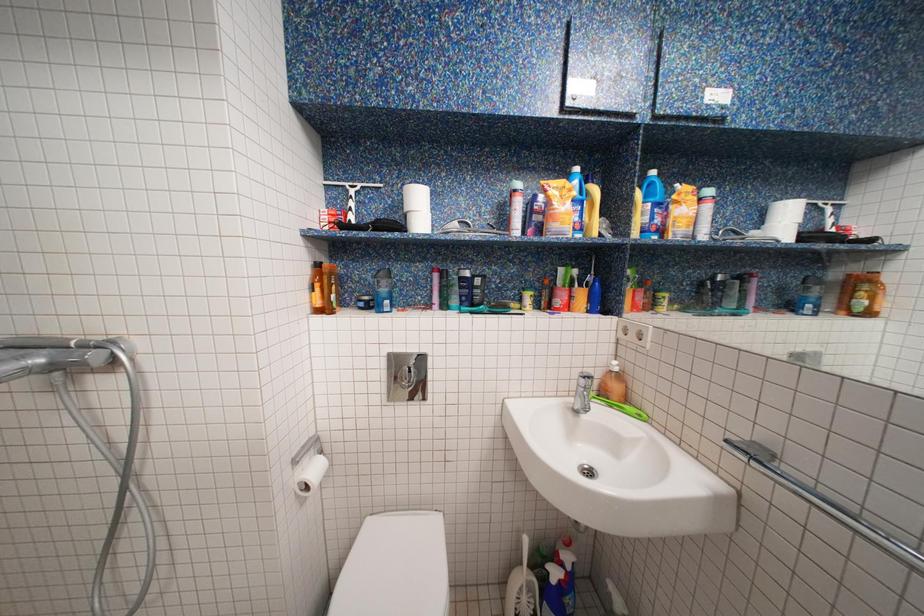
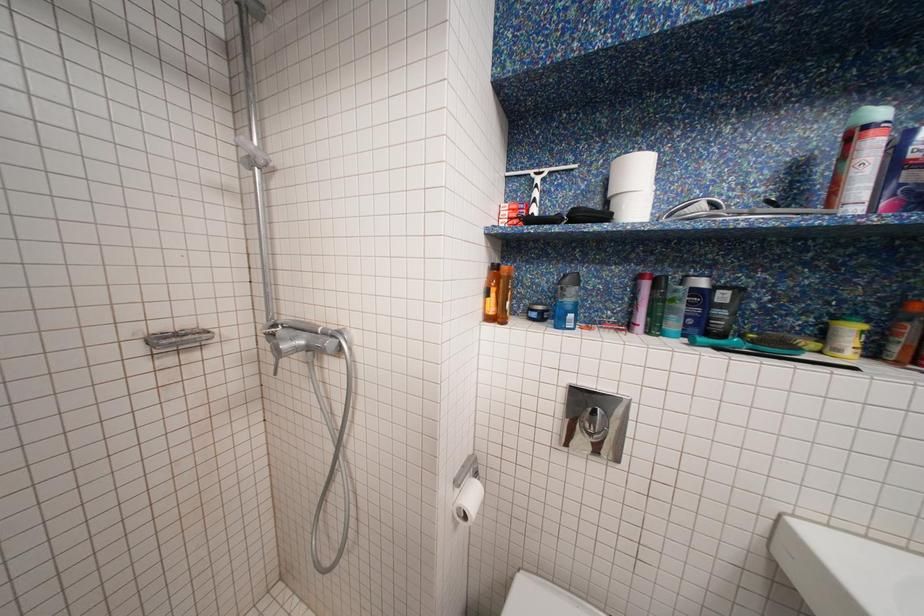
What movement of the cameraman would produce the second image?

The cameraman moved toward left, forward.